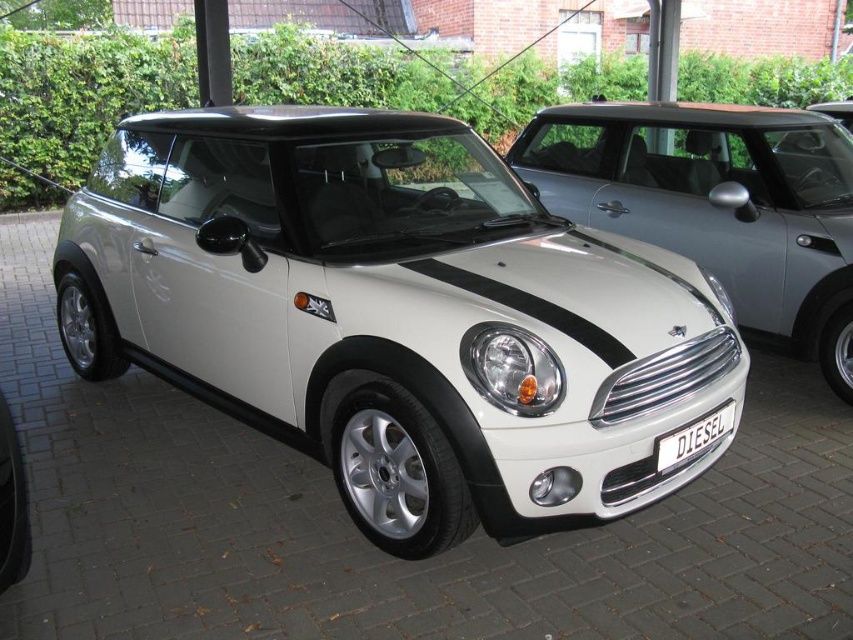
Question: Which of the following is the farthest from the observer?

Choices:
 (A) (570, 390)
 (B) (724, 413)

Answer: (B)

Question: Is white metallic car at center above white matte car at center?

Choices:
 (A) yes
 (B) no

Answer: (B)

Question: Can you confirm if white matte car at center is bigger than black metallic license plate at center?

Choices:
 (A) yes
 (B) no

Answer: (A)

Question: Does white metallic car at center have a smaller size compared to black metallic license plate at center?

Choices:
 (A) no
 (B) yes

Answer: (A)

Question: Estimate the real-world distances between objects in this image. Which object is farther from the white metallic car at center?

Choices:
 (A) black metallic license plate at center
 (B) white matte car at center

Answer: (B)

Question: Which point appears farthest from the camera in this image?

Choices:
 (A) (627, 157)
 (B) (648, 444)

Answer: (A)